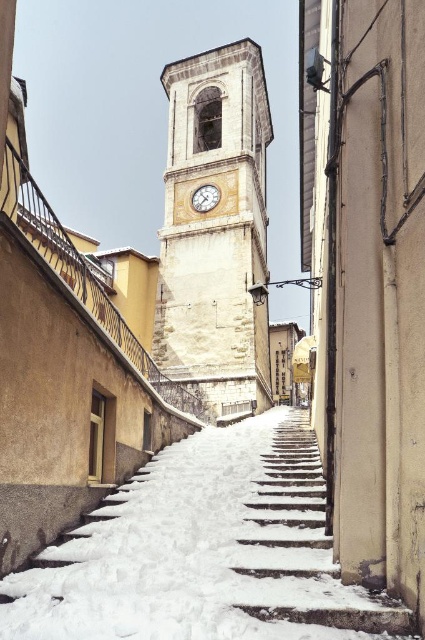
Question: Which point is farther to the camera?

Choices:
 (A) (166, 93)
 (B) (401, 620)

Answer: (A)

Question: Where is snow-covered stone stairs at center located in relation to wooden clock at center in the image?

Choices:
 (A) right
 (B) left

Answer: (A)

Question: Which object is the farthest from the wooden clock at center?

Choices:
 (A) white powdery snow at center
 (B) snow-covered stone stairs at center
 (C) white stone clock tower at center

Answer: (A)

Question: Where is white stone clock tower at center located in relation to wooden clock at center in the image?

Choices:
 (A) left
 (B) right

Answer: (B)

Question: Which object appears closest to the camera in this image?

Choices:
 (A) snow-covered stone stairs at center
 (B) wooden clock at center
 (C) white stone clock tower at center

Answer: (A)

Question: Can you confirm if white stone clock tower at center is thinner than snow-covered stone stairs at center?

Choices:
 (A) no
 (B) yes

Answer: (A)